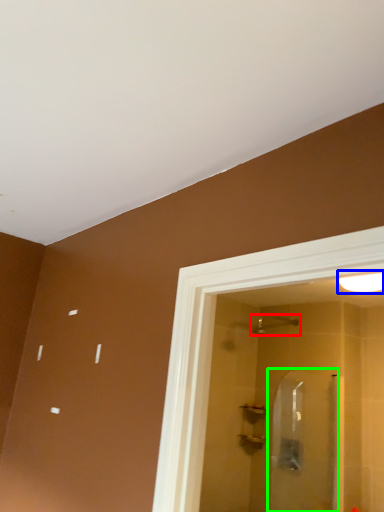
Question: Considering the real-world distances, which object is farthest from shower (highlighted by a red box)? light fixture (highlighted by a blue box) or screen door (highlighted by a green box)?

Choices:
 (A) light fixture
 (B) screen door

Answer: (A)